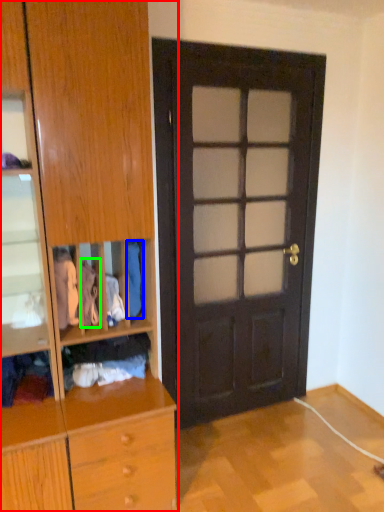
Question: Estimate the real-world distances between objects in this image. Which object is closer to cabinetry (highlighted by a red box), clothing (highlighted by a blue box) or clothing (highlighted by a green box)?

Choices:
 (A) clothing
 (B) clothing

Answer: (B)